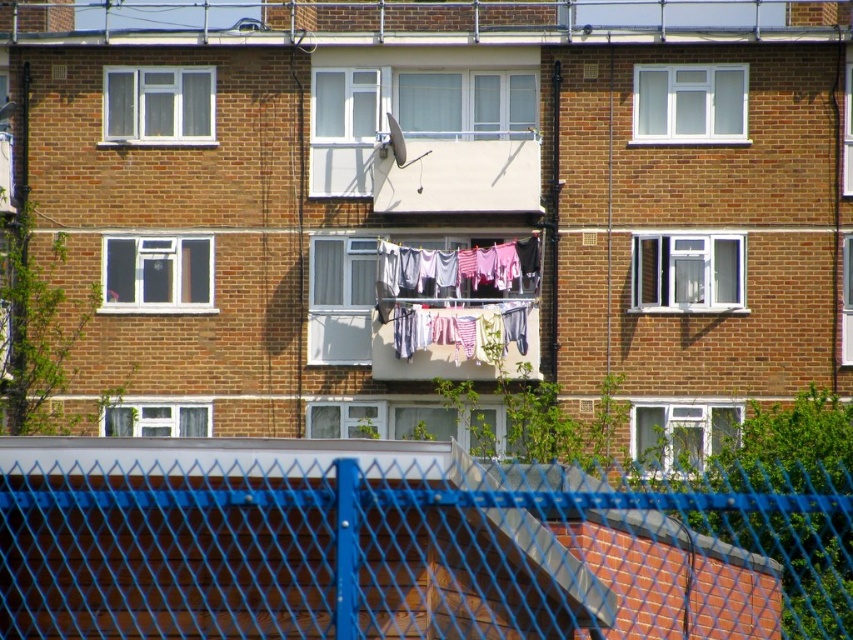
Measure the distance from blue wire mesh fence at center to white fabric clothes at center.

A distance of 6.99 meters exists between blue wire mesh fence at center and white fabric clothes at center.

Based on the photo, can you confirm if blue wire mesh fence at center is positioned below white fabric clothes at center?

Indeed, blue wire mesh fence at center is positioned under white fabric clothes at center.

Who is more forward, (421,451) or (436,266)?

Point (421,451)

Image resolution: width=853 pixels, height=640 pixels. Identify the location of blue wire mesh fence at center. (361, 545).